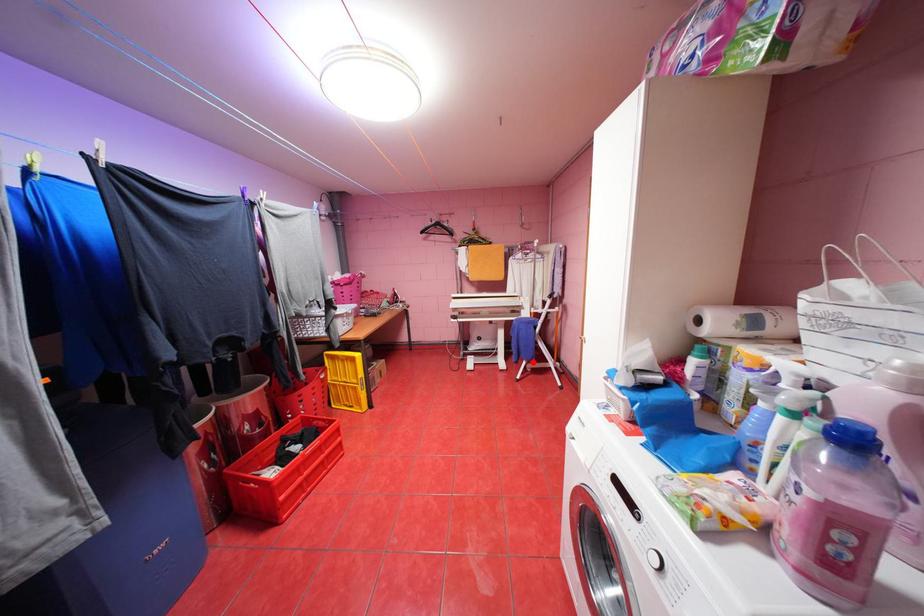
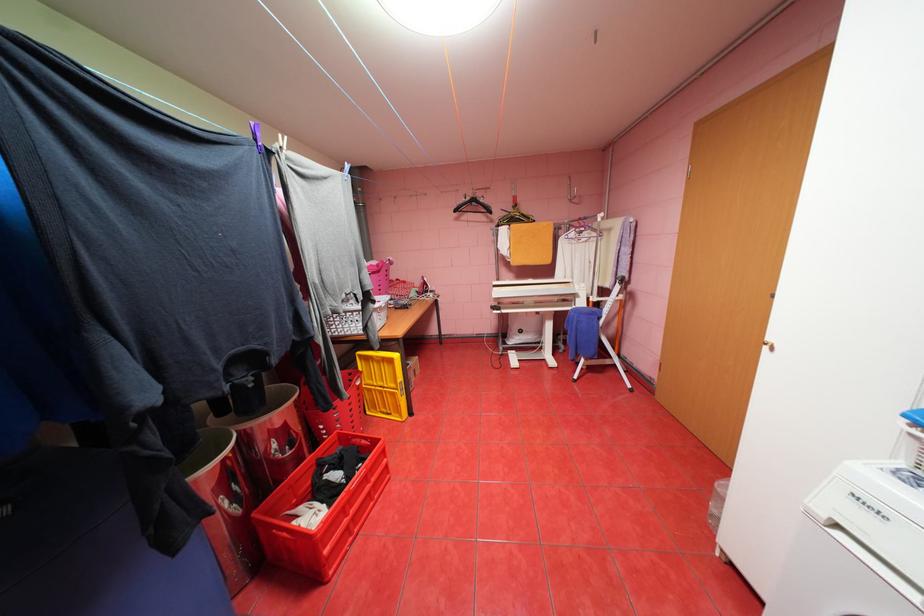
Question: I am providing you with two images of the same scene from different viewpoints. In image1, a red point is highlighted. Considering the same 3D point in image2, which of the following is correct?

Choices:
 (A) It is closer
 (B) It is farther

Answer: (A)